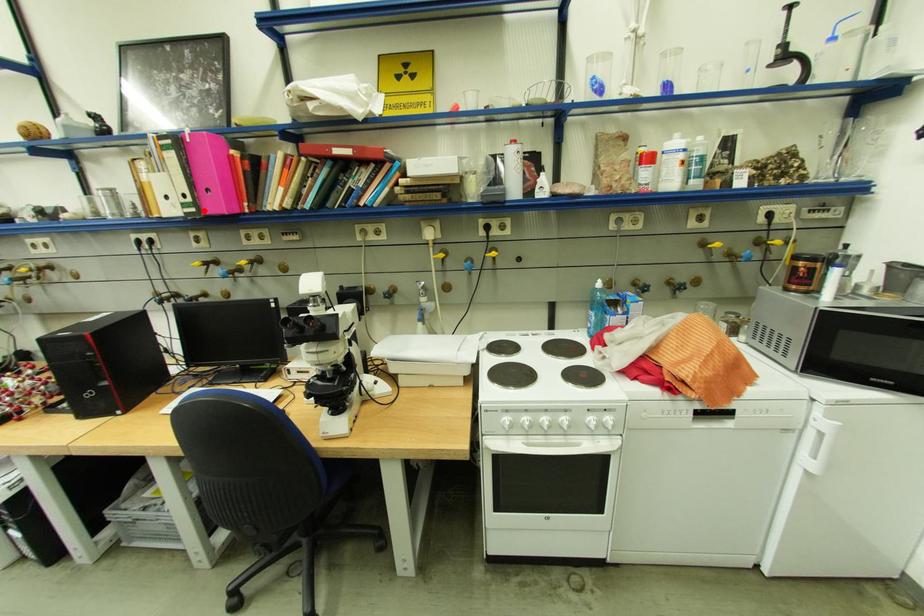
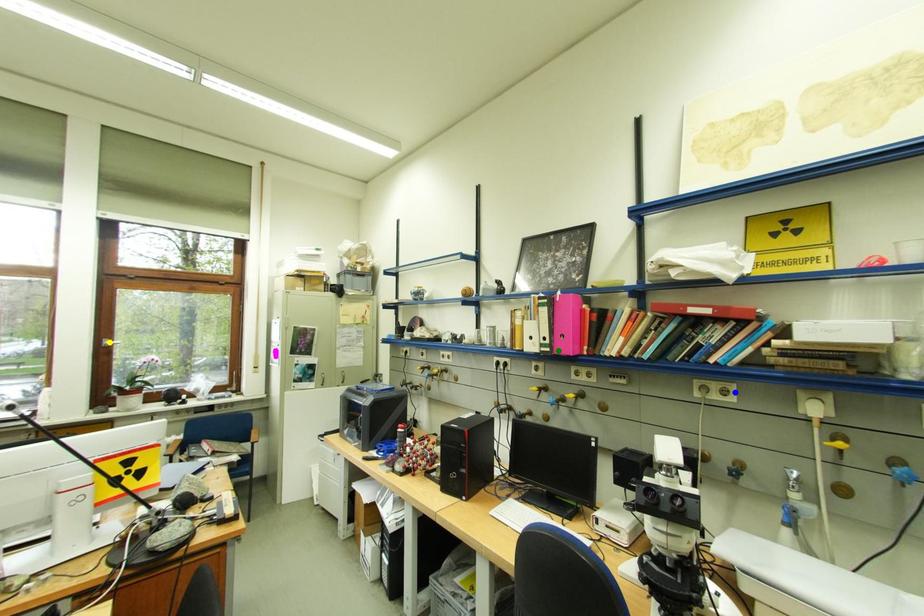
Question: I am providing you with two images of the same scene from different viewpoints. A red point is marked on the first image. You are given multiple points on the second image. Which spot in image 2 lines up with the point in image 1?

Choices:
 (A) yellow point
 (B) green point
 (C) blue point

Answer: (B)